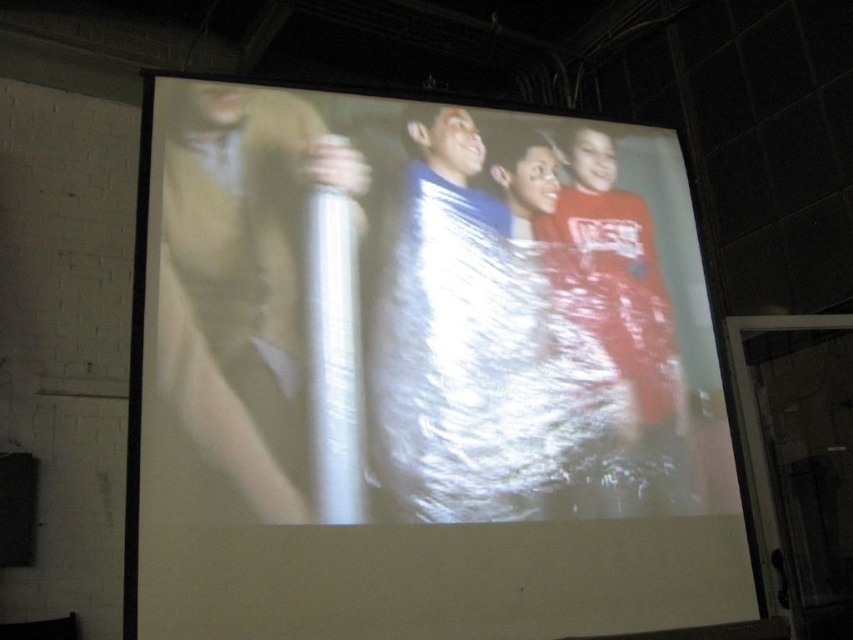
Does point (653, 148) come farther from viewer compared to point (259, 208)?

Yes, point (653, 148) is farther from viewer.

Between white glossy screen at center and metallic silver canister at left, which one appears on the left side from the viewer's perspective?

From the viewer's perspective, metallic silver canister at left appears more on the left side.

Is point (258, 305) farther from viewer compared to point (195, 88)?

No.

Locate an element on the screen. Image resolution: width=853 pixels, height=640 pixels. white glossy screen at center is located at coordinates (421, 376).